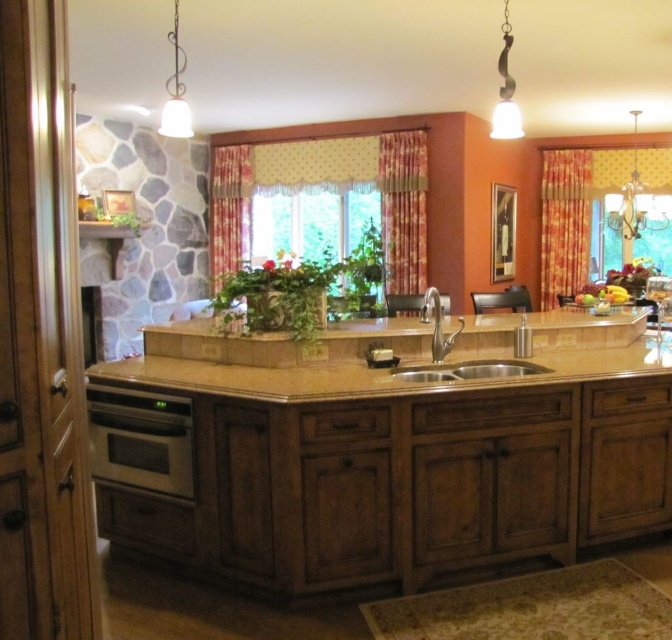
Question: Is brown granite countertop at center positioned at the back of floral fabric curtain at center?

Choices:
 (A) no
 (B) yes

Answer: (A)

Question: Which of the following is the closest to the observer?

Choices:
 (A) floral fabric curtain at upper center
 (B) polished stainless steel faucet at center
 (C) brown granite countertop at center
 (D) silver metallic sink at center

Answer: (C)

Question: Which of the following is the farthest from the observer?

Choices:
 (A) click(x=571, y=516)
 (B) click(x=420, y=381)
 (C) click(x=575, y=280)
 (D) click(x=230, y=176)

Answer: (C)

Question: Does floral fabric curtains at center appear on the right side of floral fabric curtain at upper center?

Choices:
 (A) yes
 (B) no

Answer: (A)

Question: Which object is farther from the camera taking this photo?

Choices:
 (A) satin silver oven at lower left
 (B) floral fabric curtains at center

Answer: (B)

Question: In this image, where is yellow-orange floral fabric curtain at right located relative to floral fabric curtain at upper center?

Choices:
 (A) below
 (B) above

Answer: (A)